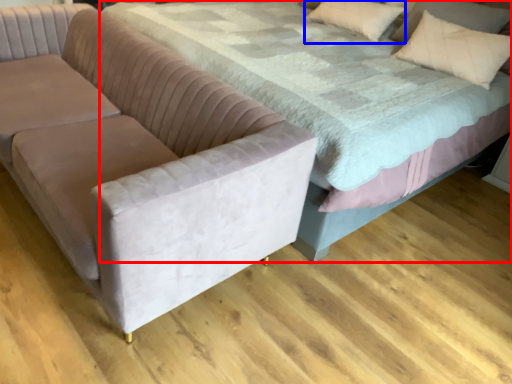
Question: Among these objects, which one is farthest to the camera, bed (highlighted by a red box) or pillow (highlighted by a blue box)?

Choices:
 (A) bed
 (B) pillow

Answer: (B)